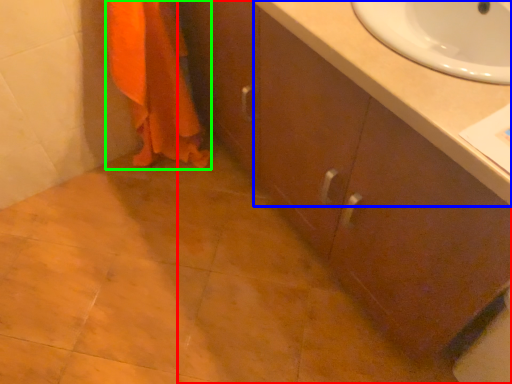
Question: Considering the real-world distances, which object is farthest from bathroom cabinet (highlighted by a red box)? counter top (highlighted by a blue box) or bath towel (highlighted by a green box)?

Choices:
 (A) counter top
 (B) bath towel

Answer: (B)